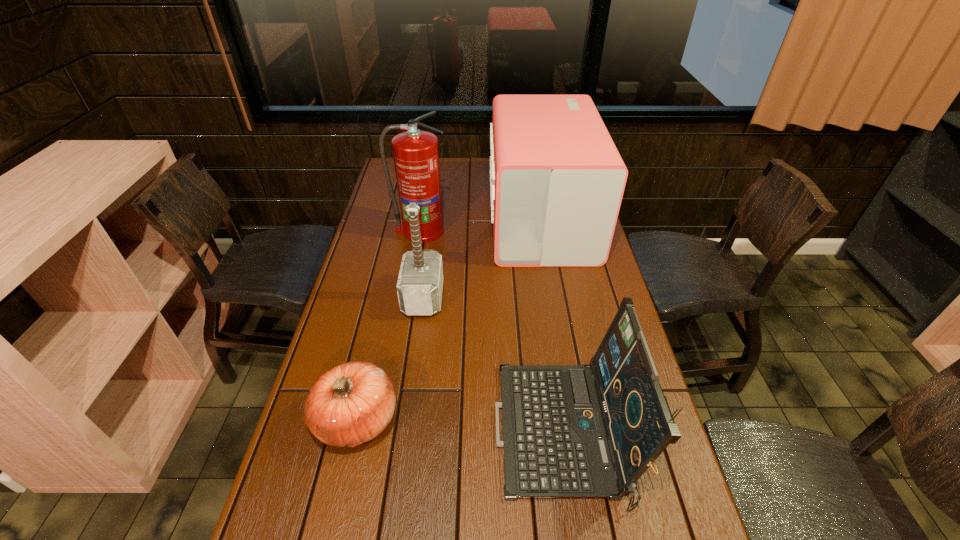
This screenshot has height=540, width=960. Find the location of `fire extinguisher`. fire extinguisher is located at coordinates (416, 158).

This screenshot has width=960, height=540. What are the coordinates of `box` in the screenshot? It's located at (557, 180).

Identify the location of hammer. The width and height of the screenshot is (960, 540). (420, 283).

The image size is (960, 540). In order to click on the second shortest object in this screenshot , I will do `click(591, 431)`.

Find the location of a particular element. pumpkin is located at coordinates (x=352, y=403).

Image resolution: width=960 pixels, height=540 pixels. I want to click on vacant position located 0.090m on the instruction side of the fire extinguisher, so click(416, 259).

The width and height of the screenshot is (960, 540). I want to click on vacant region located on the surface of the box where the text is embossed, so 468,220.

Identify the location of free region located 0.180m on the surface of the box where the text is embossed. (443, 220).

At what (x,y) coordinates should I click in order to perform the action: click on free region located on the surface of the box where the text is embossed. Please return your answer as a coordinate pair (x, y). Looking at the image, I should click on (453, 220).

Image resolution: width=960 pixels, height=540 pixels. I want to click on free region located 0.220m for striking with the head of the hammer, so [515, 297].